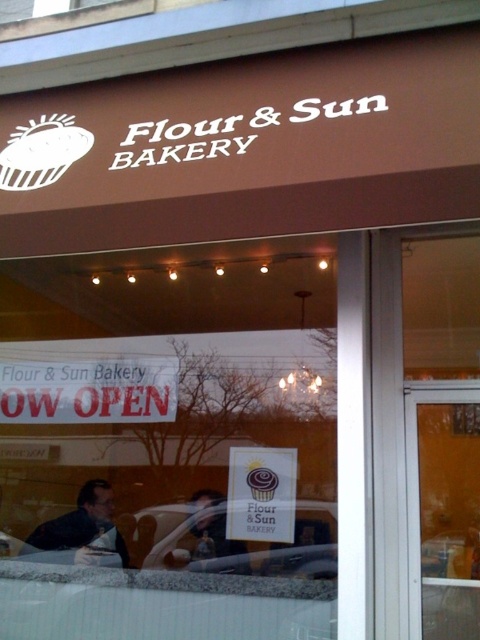
You are a customer standing outside the bakery looking through the window. You see a clear glass car at center and a matte black shirt at center. Which object is closer to you through the window?

The clear glass car at center is closer to you than the matte black shirt at center because it is further to the viewer.

You are a customer looking at the Flour and Sun Bakery window display. You see a person with dark brown hair at lower left and a person in a matte black shirt at center. Which person is closer to the left side of the window?

The dark brown hair at lower left is positioned on the left side of matte black shirt at center, so the person with dark brown hair at lower left is closer to the left side of the window.